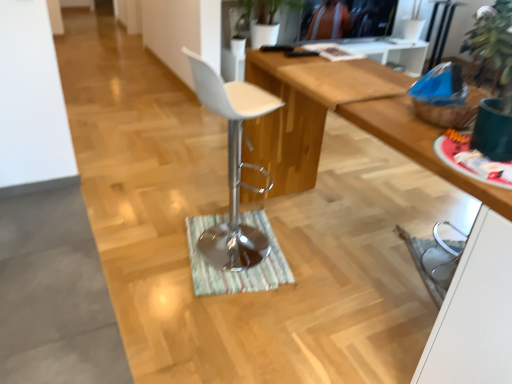
The height and width of the screenshot is (384, 512). I want to click on free region on the left part of wooden desk at center, so click(x=142, y=272).